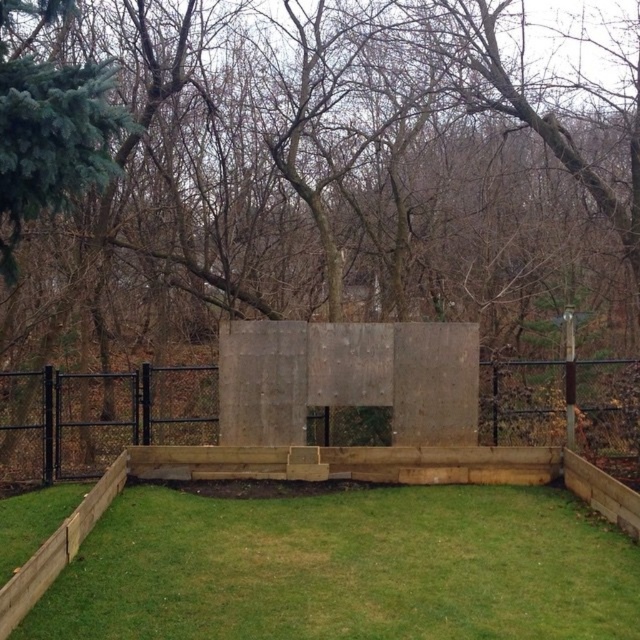
What do you see at coordinates (332, 182) in the screenshot? The image size is (640, 640). I see `green leafy tree at center` at bounding box center [332, 182].

Identify the location of green leafy tree at center. (332, 182).

The height and width of the screenshot is (640, 640). I want to click on green leafy tree at center, so click(332, 182).

You are a GUI agent. You are given a task and a screenshot of the screen. Output one action in this format:
    pyautogui.click(x=<x>, y=<y>)
    Task: Click on the green leafy tree at center
    The width and height of the screenshot is (640, 640).
    Given the screenshot: What is the action you would take?
    pyautogui.click(x=332, y=182)

In the scene shown: Who is shorter, green grass at lower center or brown wood fence at center?

green grass at lower center

Locate an element on the screen. The height and width of the screenshot is (640, 640). green grass at lower center is located at coordinates pyautogui.click(x=346, y=568).

Identify the location of green grass at lower center. (346, 568).

Locate an element on the screen. green grass at lower center is located at coordinates (346, 568).

Can you confirm if green leafy tree at center is positioned to the left of green grass at lower center?

Incorrect, green leafy tree at center is not on the left side of green grass at lower center.

Find the location of a particular element. green leafy tree at center is located at coordinates (332, 182).

Identify the location of green leafy tree at center. (332, 182).